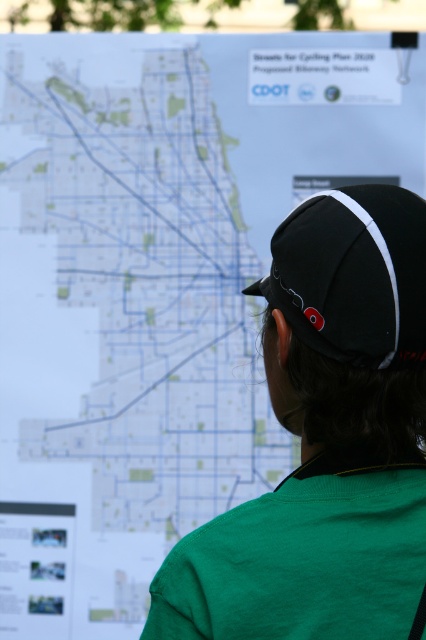
How much distance is there between green fabric shirt at center and black fabric baseball cap at center?

green fabric shirt at center and black fabric baseball cap at center are 3.56 inches apart.

Between green fabric shirt at center and black fabric baseball cap at center, which one is positioned higher?

black fabric baseball cap at center is higher up.

Which is behind, point (419, 576) or point (411, 220)?

The point (411, 220) is behind.

Locate an element on the screen. This screenshot has height=640, width=426. green fabric shirt at center is located at coordinates (325, 442).